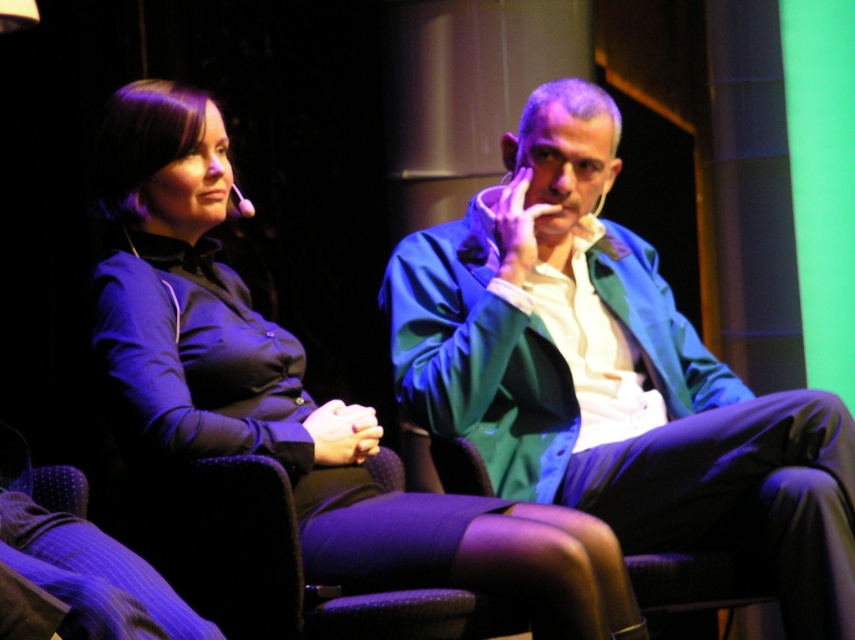
Who is more forward, [833,586] or [317,560]?

Point [317,560] is more forward.

This screenshot has height=640, width=855. Find the location of `matte green blazer at center`. matte green blazer at center is located at coordinates (616, 369).

Image resolution: width=855 pixels, height=640 pixels. What do you see at coordinates (616, 369) in the screenshot?
I see `matte green blazer at center` at bounding box center [616, 369].

Where is `matte green blazer at center`? Image resolution: width=855 pixels, height=640 pixels. matte green blazer at center is located at coordinates (616, 369).